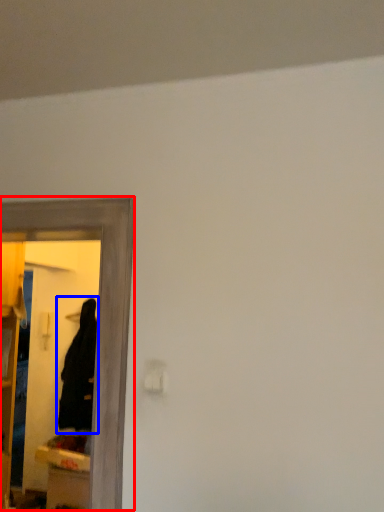
Question: Which of the following is the farthest to the observer, mirror (highlighted by a red box) or robe (highlighted by a blue box)?

Choices:
 (A) mirror
 (B) robe

Answer: (B)